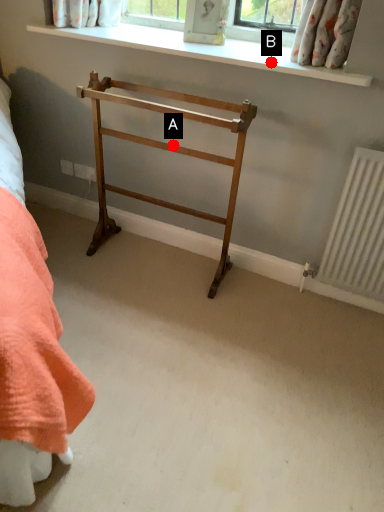
Question: Two points are circled on the image, labeled by A and B beside each circle. Which of the following is the farthest from the observer?

Choices:
 (A) A is further
 (B) B is further

Answer: (A)